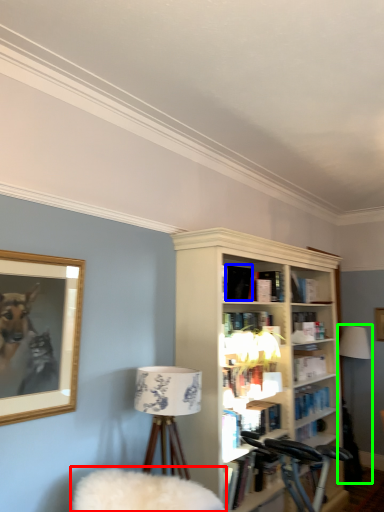
Question: Estimate the real-world distances between objects in this image. Which object is closer to swivel chair (highlighted by a red box), book (highlighted by a blue box) or table lamp (highlighted by a green box)?

Choices:
 (A) book
 (B) table lamp

Answer: (A)